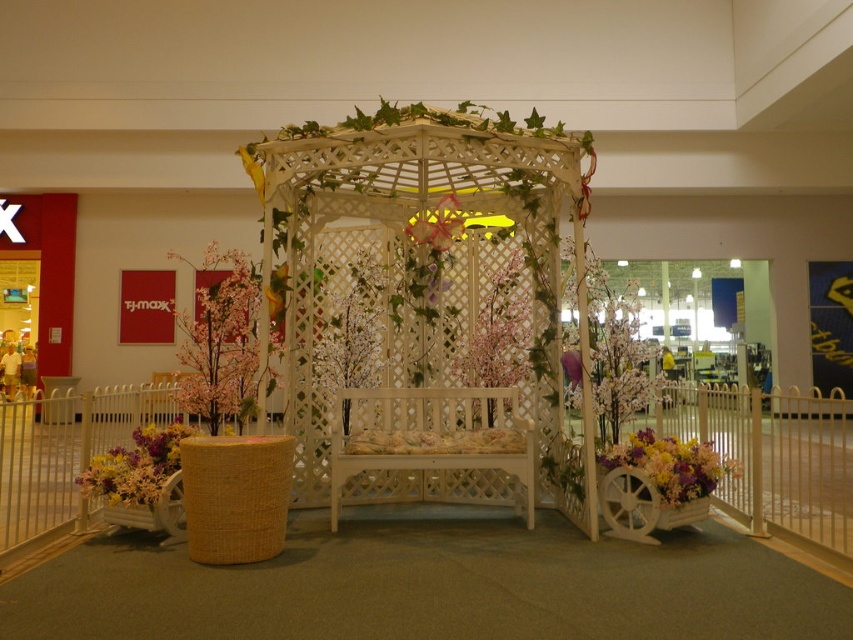
You are standing at the center of the shopping mall and see a point marked at coordinates (x=428, y=307). What object is located exactly at that point?

The white lattice gazebo at center is located exactly at the point marked at coordinates (x=428, y=307).

Looking at this image, you are a florist who wants to place a new bouquet in the shopping mall gazebo area. The current arrangement has the white lattice gazebo at center and vibrant floral bouquet at lower left. According to the scene, where exactly is the vibrant floral bouquet located relative to the gazebo?

The vibrant floral bouquet at lower left is positioned below the white lattice gazebo at center, as the gazebo is positioned over it.